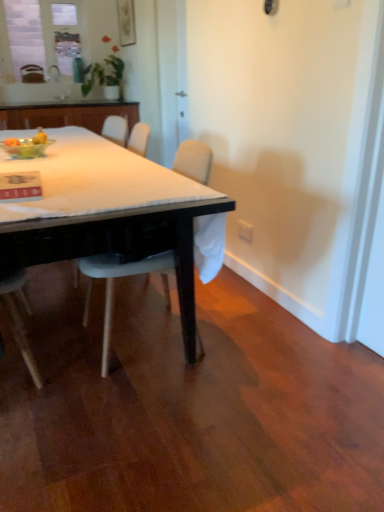
Question: From a real-world perspective, is matte black table at center under white plastic chair at center, which appears as the first chair when viewed from the right?

Choices:
 (A) yes
 (B) no

Answer: (B)

Question: Is matte black table at center located outside white plastic chair at center, positioned as the first chair in front-to-back order?

Choices:
 (A) yes
 (B) no

Answer: (A)

Question: Can you confirm if matte black table at center is shorter than white plastic chair at center, marked as the 2th chair in a back-to-front arrangement?

Choices:
 (A) yes
 (B) no

Answer: (A)

Question: Is matte black table at center smaller than white plastic chair at center, positioned as the first chair in front-to-back order?

Choices:
 (A) no
 (B) yes

Answer: (B)

Question: Is the position of matte black table at center more distant than that of white plastic chair at center, acting as the second chair starting from the left?

Choices:
 (A) no
 (B) yes

Answer: (A)

Question: Can you confirm if matte black table at center is positioned to the left of white plastic chair at center, positioned as the first chair in front-to-back order?

Choices:
 (A) no
 (B) yes

Answer: (B)

Question: Does matte black table at center turn towards white plastic power outlet at lower right?

Choices:
 (A) no
 (B) yes

Answer: (A)

Question: From a real-world perspective, does matte black table at center stand above white plastic power outlet at lower right?

Choices:
 (A) yes
 (B) no

Answer: (A)

Question: Is matte black table at center positioned far away from white plastic power outlet at lower right?

Choices:
 (A) no
 (B) yes

Answer: (B)

Question: Does matte black table at center have a smaller size compared to white plastic power outlet at lower right?

Choices:
 (A) no
 (B) yes

Answer: (A)

Question: From the image's perspective, is matte black table at center located above white plastic power outlet at lower right?

Choices:
 (A) yes
 (B) no

Answer: (A)

Question: Can you confirm if matte black table at center is positioned to the left of white plastic power outlet at lower right?

Choices:
 (A) no
 (B) yes

Answer: (B)

Question: Does transparent glass bottle at upper center turn towards white glossy sink at upper center?

Choices:
 (A) no
 (B) yes

Answer: (A)